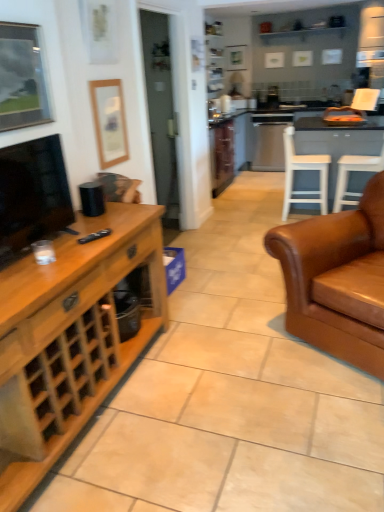
At what (x,y) coordinates should I click in order to perform the action: click on vacant point to the right of matte black tv at left. Please return your answer as a coordinate pair (x, y). Image resolution: width=384 pixels, height=512 pixels. Looking at the image, I should click on (82, 243).